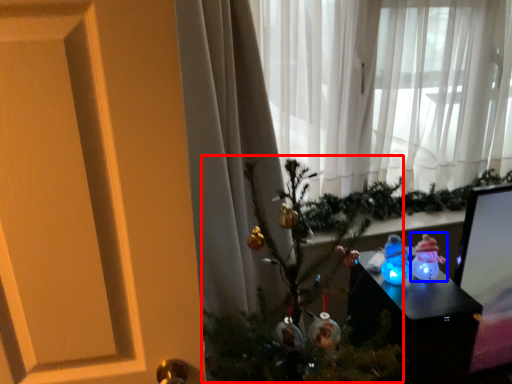
Question: Which point is closer to the camera, christmas tree (highlighted by a red box) or toy (highlighted by a blue box)?

Choices:
 (A) christmas tree
 (B) toy

Answer: (A)